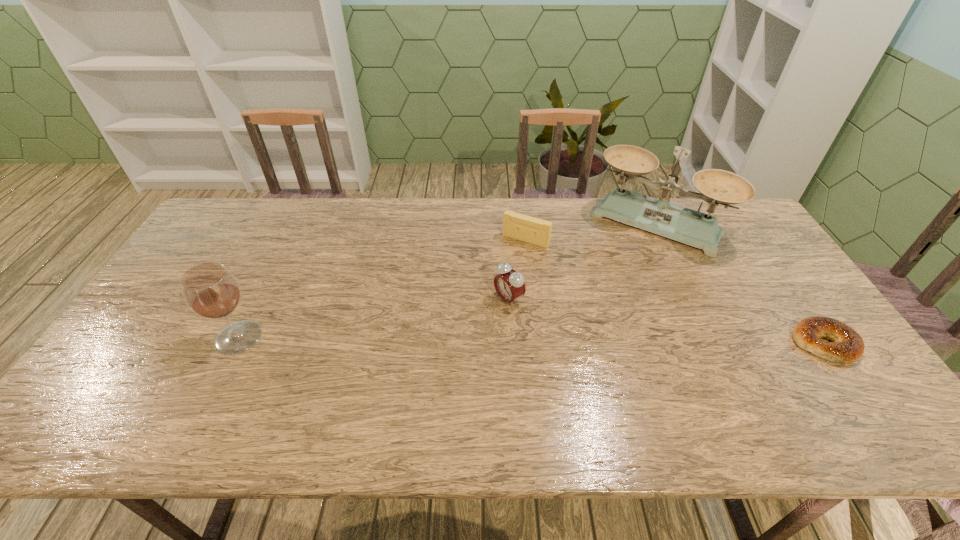
Locate an element on the screen. wineglass is located at coordinates (210, 290).

This screenshot has width=960, height=540. I want to click on the leftmost object, so click(x=210, y=290).

Find the location of a particular element. The image size is (960, 540). the shortest object is located at coordinates (847, 345).

Find the location of a particular element. videotape is located at coordinates (536, 231).

In order to click on scale in this screenshot , I will do pos(659,216).

Find the location of a particular element. Image resolution: width=960 pixels, height=540 pixels. the third shortest object is located at coordinates (509, 284).

This screenshot has height=540, width=960. Identify the location of the third farthest object. (509, 284).

Locate an element on the screen. This screenshot has width=960, height=540. free space located 0.080m on the front of the fourth shortest object is located at coordinates (216, 383).

Find the location of a particular element. This screenshot has width=960, height=540. free region located on the back of the shortest object is located at coordinates (760, 252).

This screenshot has width=960, height=540. In order to click on vacant area located at the front of the videotape with spools in this screenshot , I will do `click(475, 313)`.